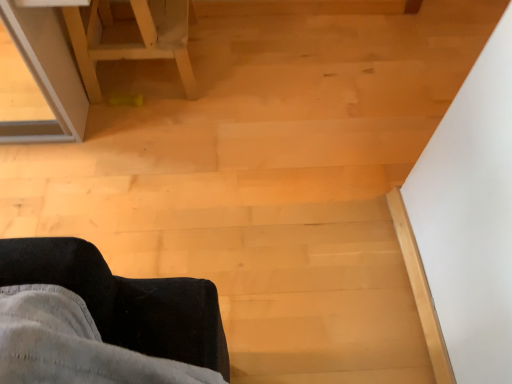
Describe the element at coordinates (130, 38) in the screenshot. I see `wooden stool at upper left` at that location.

You are a GUI agent. You are given a task and a screenshot of the screen. Output one action in this format:
    pyautogui.click(x=<x>, y=<y>)
    Task: Click on the wooden stool at upper left
    
    Given the screenshot: What is the action you would take?
    pyautogui.click(x=130, y=38)

Identify the location of wooden stool at upper left. This screenshot has height=384, width=512. (130, 38).